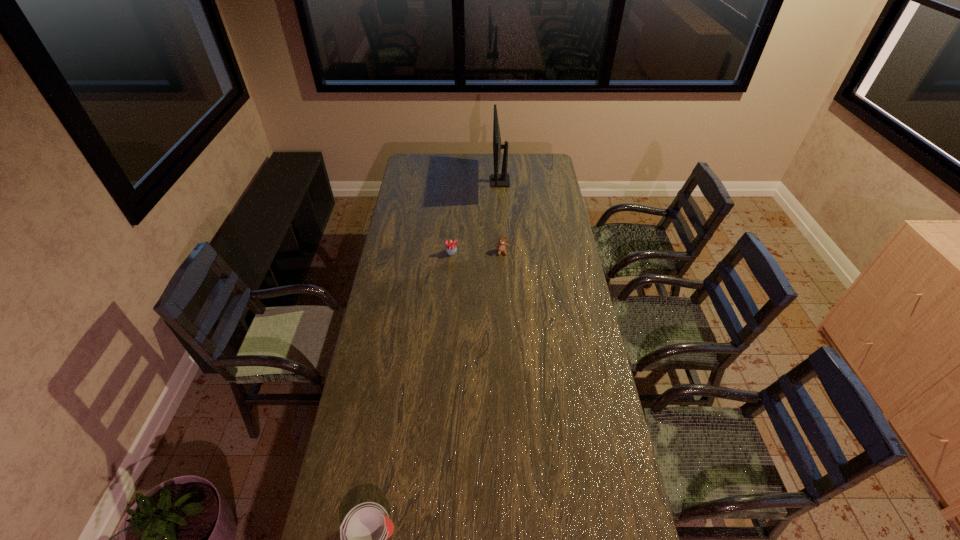
Where is `computer monitor`? This screenshot has width=960, height=540. computer monitor is located at coordinates (497, 180).

The height and width of the screenshot is (540, 960). In order to click on the tallest object in this screenshot , I will do `click(497, 180)`.

Find the location of a particular element. The width and height of the screenshot is (960, 540). teddy bear is located at coordinates (501, 246).

Find the location of `cupcake`. cupcake is located at coordinates (451, 248).

The image size is (960, 540). In order to click on vacant space located 0.190m on the front-facing side of the computer monitor in this screenshot , I will do `click(458, 181)`.

You are a GUI agent. You are given a task and a screenshot of the screen. Output one action in this format:
    pyautogui.click(x=<x>, y=<y>)
    Task: Click on the free region located 0.360m on the front-facing side of the computer monitor
    
    Given the screenshot: What is the action you would take?
    pyautogui.click(x=428, y=181)

Identify the location of vacant space situated on the front-facing side of the computer monitor. (424, 181).

The image size is (960, 540). Identify the location of vacant space located on the front-facing side of the teddy bear. tap(503, 272).

I want to click on vacant region located 0.170m on the face of the second object from left to right, so click(x=449, y=282).

Locate an element on the screen. object that is at the far edge is located at coordinates [x=497, y=180].